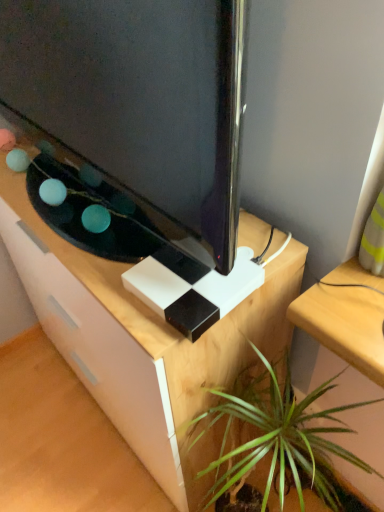
Question: Considering the relative sizes of white matte desk at center and green leafy plant at lower center in the image provided, is white matte desk at center smaller than green leafy plant at lower center?

Choices:
 (A) yes
 (B) no

Answer: (B)

Question: Considering the relative positions of white matte desk at center and green leafy plant at lower center in the image provided, is white matte desk at center to the left of green leafy plant at lower center from the viewer's perspective?

Choices:
 (A) yes
 (B) no

Answer: (A)

Question: Can you confirm if white matte desk at center is wider than green leafy plant at lower center?

Choices:
 (A) yes
 (B) no

Answer: (A)

Question: Would you consider white matte desk at center to be distant from green leafy plant at lower center?

Choices:
 (A) no
 (B) yes

Answer: (A)

Question: From a real-world perspective, is white matte desk at center over green leafy plant at lower center?

Choices:
 (A) no
 (B) yes

Answer: (B)

Question: Would you say matte black tv at center is to the left or to the right of green leafy plant at lower center in the picture?

Choices:
 (A) left
 (B) right

Answer: (A)

Question: From a real-world perspective, is matte black tv at center physically located above or below green leafy plant at lower center?

Choices:
 (A) below
 (B) above

Answer: (B)

Question: Considering the positions of matte black tv at center and green leafy plant at lower center in the image, is matte black tv at center wider or thinner than green leafy plant at lower center?

Choices:
 (A) thin
 (B) wide

Answer: (A)

Question: In terms of size, does matte black tv at center appear bigger or smaller than green leafy plant at lower center?

Choices:
 (A) big
 (B) small

Answer: (A)

Question: Based on their sizes in the image, would you say matte black tv at center is bigger or smaller than white matte desk at center?

Choices:
 (A) big
 (B) small

Answer: (B)

Question: Would you say matte black tv at center is inside or outside white matte desk at center?

Choices:
 (A) inside
 (B) outside

Answer: (B)

Question: From the image's perspective, is matte black tv at center above or below white matte desk at center?

Choices:
 (A) below
 (B) above

Answer: (B)

Question: Considering the positions of matte black tv at center and white matte desk at center in the image, is matte black tv at center taller or shorter than white matte desk at center?

Choices:
 (A) tall
 (B) short

Answer: (B)

Question: Relative to white matte desk at center, is green leafy plant at lower center in front or behind?

Choices:
 (A) behind
 (B) front

Answer: (B)

Question: Which is correct: green leafy plant at lower center is inside white matte desk at center, or outside of it?

Choices:
 (A) outside
 (B) inside

Answer: (A)